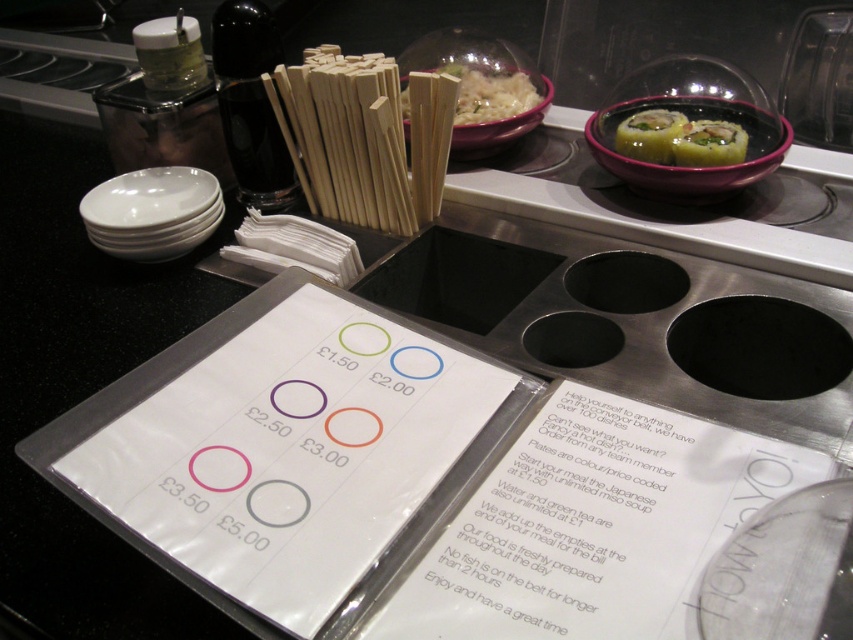
You are a customer at the sushi restaurant and want to know if the white paper menu at center is taller than the green matte sushi at upper right. Can you confirm this based on the scene?

The white paper menu at center is much taller than the green matte sushi at upper right, so yes, the white paper menu at center is taller than the green matte sushi at upper right.

You are a customer in a sushi restaurant and want to check the menu while grabbing a sushi from the conveyor belt. The white paper menu at center and the green matte sushi at upper right are in your view. Can you reach both items without moving your position if your arm can extend 18 inches?

The distance between the white paper menu at center and the green matte sushi at upper right is 18.46 inches. Since your arm can only extend 18 inches, you cannot reach both items without moving your position.

You are a customer at the sushi restaurant and want to take a plate from the conveyor belt. The purple glossy bowl at upper right and white matte rice at center are both on the belt. Which one should you grab first if you want the closest item?

The purple glossy bowl at upper right is closer to the viewer than the white matte rice at center, so you should grab the purple glossy bowl at upper right first.